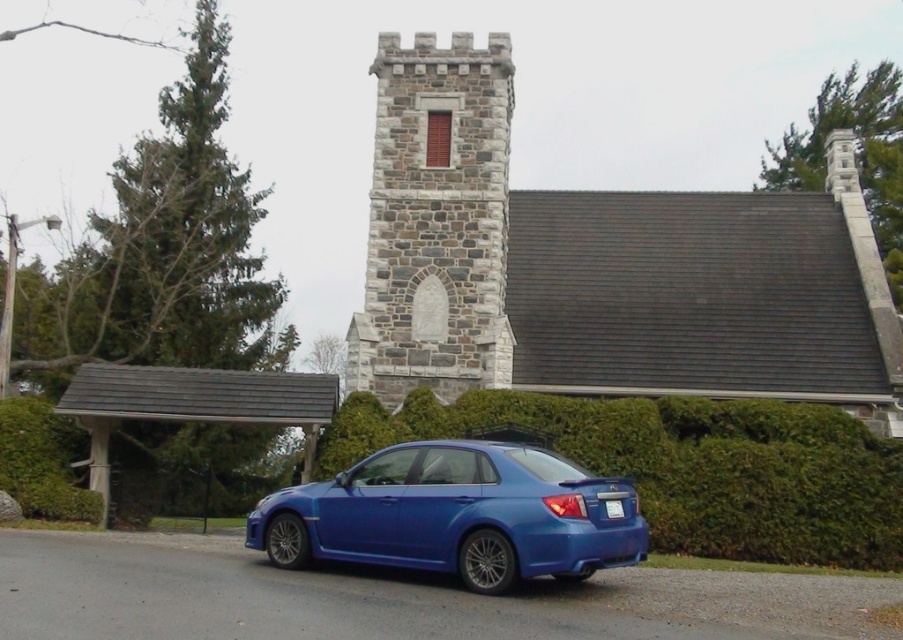
You are standing on the paved road in front of the stone church at center. You want to take a photo of the church with your smartphone. To ensure the entire church fits in the frame, you need to be at least 130 feet away. Are you within the required distance?

The stone church at center is 134.45 feet away from the viewer, which is more than the required 130 feet. Therefore, you are within the required distance to take the photo.

You are standing at the point with coordinates point (601, 266). Based on the scene description, what object are you directly facing?

You are directly facing the stone church at center, as the point (601, 266) corresponds to that object according to the description.